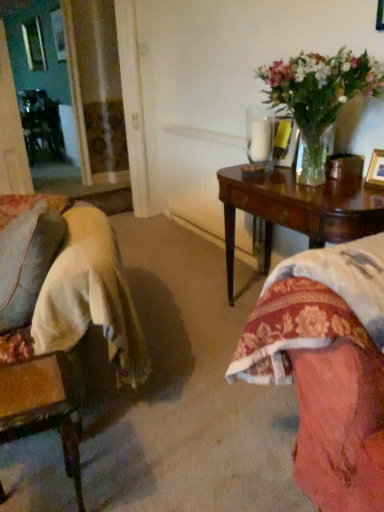
Where is `free space to the left of wooden picture frame at upper right`? free space to the left of wooden picture frame at upper right is located at coordinates (346, 194).